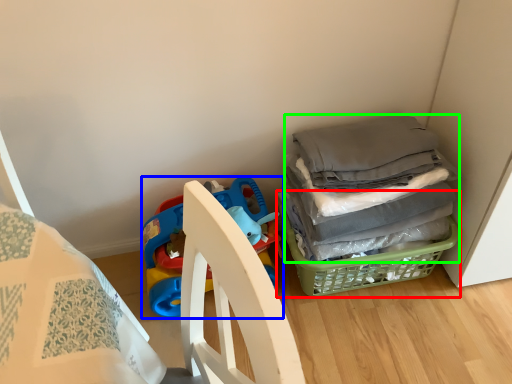
Question: Which object is the closest to the basket (highlighted by a red box)? Choose among these: toy (highlighted by a blue box) or clothing (highlighted by a green box).

Choices:
 (A) toy
 (B) clothing

Answer: (B)